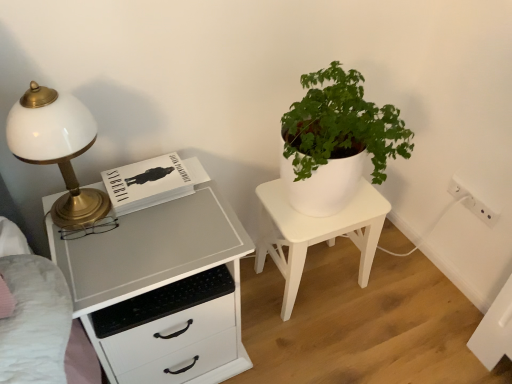
Locate an element on the screen. free space that is in between white glossy chest of drawers at left and white matte/porcelain nightstand at center is located at coordinates (279, 321).